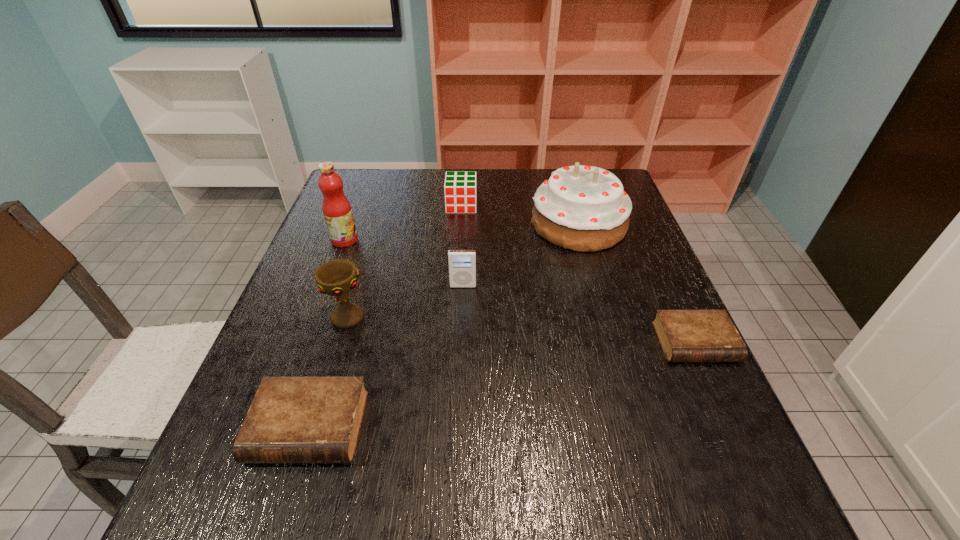
In order to click on the nearest object in this screenshot , I will do point(291,419).

At what (x,y) coordinates should I click in order to perform the action: click on the left diary. Please return your answer as a coordinate pair (x, y). Looking at the image, I should click on (291, 419).

Image resolution: width=960 pixels, height=540 pixels. Find the location of `the farther diary`. the farther diary is located at coordinates (685, 335).

Where is `the right diary`? This screenshot has height=540, width=960. the right diary is located at coordinates (685, 335).

Find the location of a particular element. The width and height of the screenshot is (960, 540). cube is located at coordinates (460, 187).

Find the location of a particular element. The width and height of the screenshot is (960, 540). the tallest object is located at coordinates (336, 208).

You are a GUI agent. You are given a task and a screenshot of the screen. Output one action in this format:
    pyautogui.click(x=<x>, y=<y>)
    Task: Click on the cake
    This screenshot has height=540, width=960.
    Given the screenshot: What is the action you would take?
    pyautogui.click(x=581, y=208)

Identify the location of the third tallest object. (338, 277).

Find the location of `the fourth shortest object`. the fourth shortest object is located at coordinates (462, 263).

The image size is (960, 540). What are the coordinates of `the fourth nearest object` in the screenshot? It's located at (462, 263).